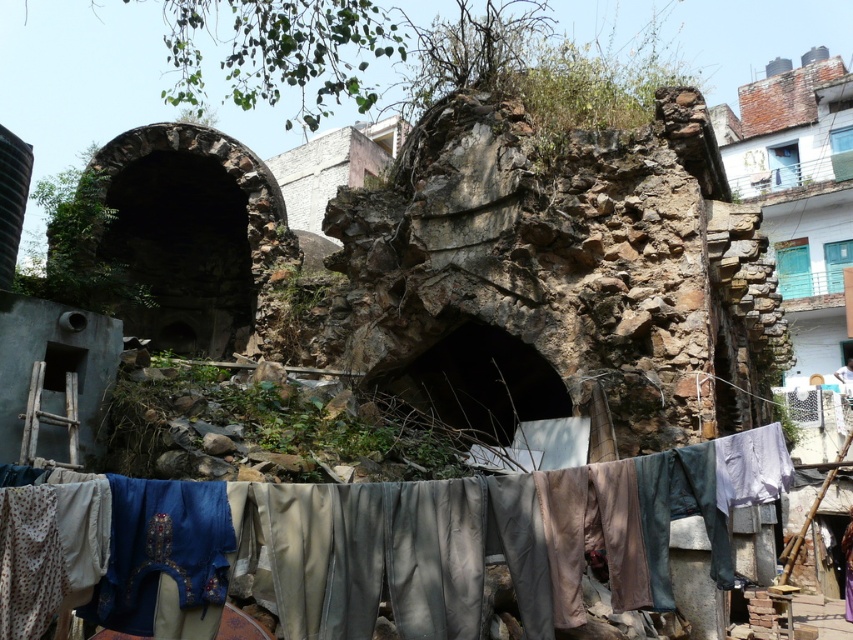
You are a painter setting up an easel to capture the contrast between the ancient ruins and modern buildings. You notice the textured fabric clothesline at center and the rustic stone wall at upper right. Which object would you focus on to emphasize the theme of decay versus modernity in your painting?

The rustic stone wall at upper right, being part of the ancient structure, represents decay, while the modern buildings in the background symbolize modernity. The clothesline at center, though part of the scene, is narrower than the stone wall and may not effectively contrast with the modern elements.

You are a photographer aiming to capture the rusty stone arch at upper center without any obstructions. You notice the textured fabric clothesline at center in the foreground. Will the clothesline block your view of the arch?

The textured fabric clothesline at center is below the rusty stone arch at upper center, so it will block the view of the arch unless moved or adjusted.

You are standing in front of the ancient archway and want to take a photo that includes both the collapsed archway and the modern blue door in the background. You notice two points marked as point (834, 83) and point (335, 131). Which point should you focus on to ensure both the collapsed archway and the modern blue door are in sharp focus?

You should focus on point (335, 131) because it is closer to the camera than point (834, 83). Since the modern blue door is in the background and the collapsed archway is in the foreground, focusing on the closer point will keep both elements in focus.